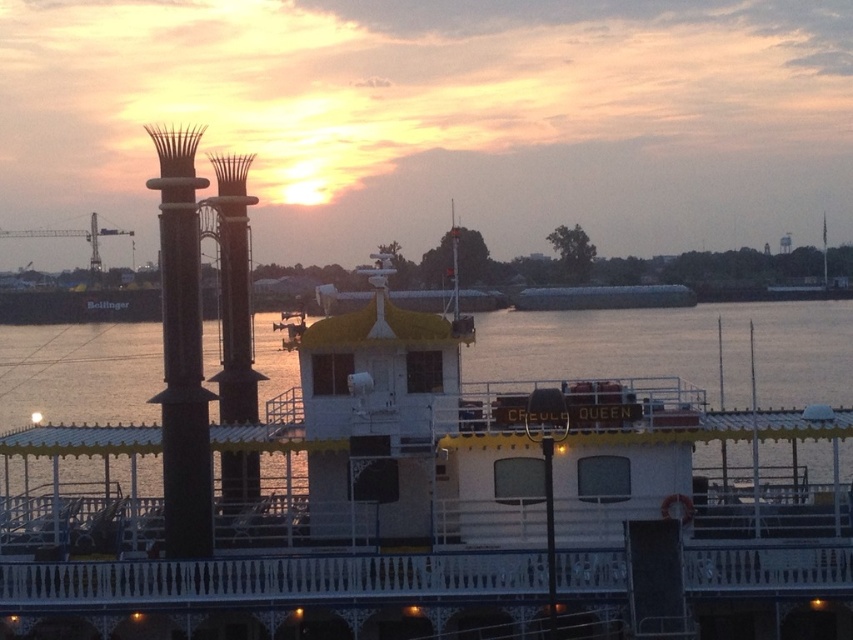
You are a photographer planning to capture the sunset at the riverside. You have a camera with a limited height adjustment range. You need to decide whether to focus on the white wooden boat at center or the polished brass column at center to ensure your camera can capture the entire subject without moving. Based on their heights, which one should you choose?

The white wooden boat at center is taller than the polished brass column at center. Therefore, you should focus on the polished brass column at center to ensure your camera can capture the entire subject without needing to adjust the height further.

You are standing on the deck of the Creole Queen paddlewheel boat and looking at two points marked in the scene. The first point is at coordinates point (819, 337) and the second point is at point (194, 467). Which point is closer to you?

Point (819, 337) is further to the viewer than point (194, 467), so the second point is closer to you.